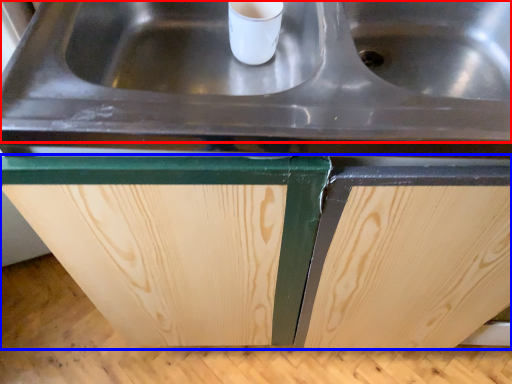
Question: Which object is closer to the camera taking this photo, sink (highlighted by a red box) or cabinetry (highlighted by a blue box)?

Choices:
 (A) sink
 (B) cabinetry

Answer: (A)